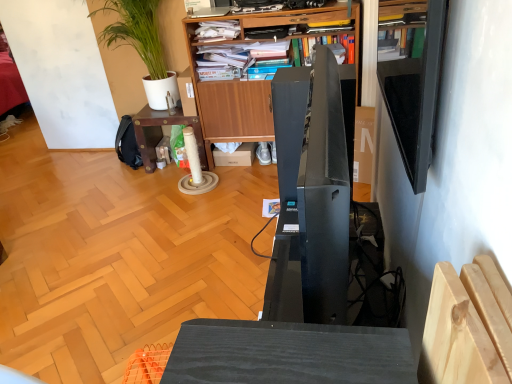
Question: Is black glossy shelf at upper right taller than wooden bookcase at upper center?

Choices:
 (A) yes
 (B) no

Answer: (B)

Question: Is black glossy shelf at upper right at the right side of wooden bookcase at upper center?

Choices:
 (A) yes
 (B) no

Answer: (A)

Question: Is black glossy shelf at upper right completely or partially outside of wooden bookcase at upper center?

Choices:
 (A) no
 (B) yes

Answer: (B)

Question: Does black glossy shelf at upper right have a greater width compared to wooden bookcase at upper center?

Choices:
 (A) no
 (B) yes

Answer: (A)

Question: Is black glossy shelf at upper right closer to camera compared to wooden bookcase at upper center?

Choices:
 (A) no
 (B) yes

Answer: (B)

Question: From a real-world perspective, is black glossy shelf at upper right positioned under wooden bookcase at upper center based on gravity?

Choices:
 (A) no
 (B) yes

Answer: (A)

Question: Considering the relative positions of wooden bookcase at upper center and wooden table at center in the image provided, is wooden bookcase at upper center to the right of wooden table at center from the viewer's perspective?

Choices:
 (A) no
 (B) yes

Answer: (B)

Question: From the image's perspective, is wooden bookcase at upper center over wooden table at center?

Choices:
 (A) no
 (B) yes

Answer: (B)

Question: Does wooden bookcase at upper center have a lesser width compared to wooden table at center?

Choices:
 (A) no
 (B) yes

Answer: (B)

Question: Is the depth of wooden bookcase at upper center less than that of wooden table at center?

Choices:
 (A) yes
 (B) no

Answer: (A)

Question: Is wooden bookcase at upper center outside wooden table at center?

Choices:
 (A) no
 (B) yes

Answer: (B)

Question: Is wooden bookcase at upper center positioned with its back to wooden table at center?

Choices:
 (A) yes
 (B) no

Answer: (B)

Question: Is wooden table at center at the right side of black glossy speaker at center?

Choices:
 (A) no
 (B) yes

Answer: (A)